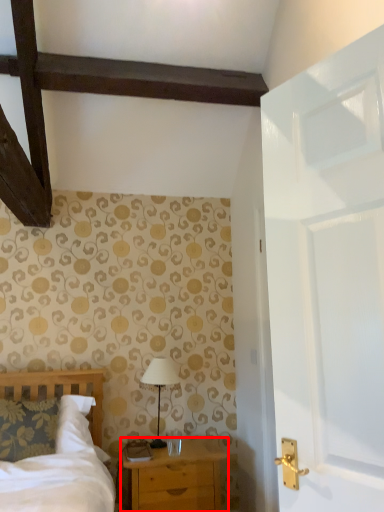
Question: In this image, where is chest of drawers (annotated by the red box) located relative to table lamp?

Choices:
 (A) left
 (B) right

Answer: (B)